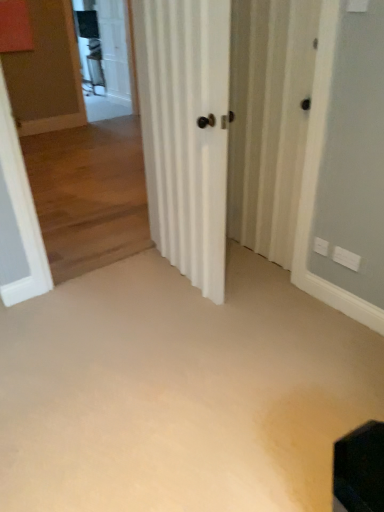
Locate an element on the screen. This screenshot has width=384, height=512. vacant space situated above beige carpet at center (from a real-world perspective) is located at coordinates (163, 347).